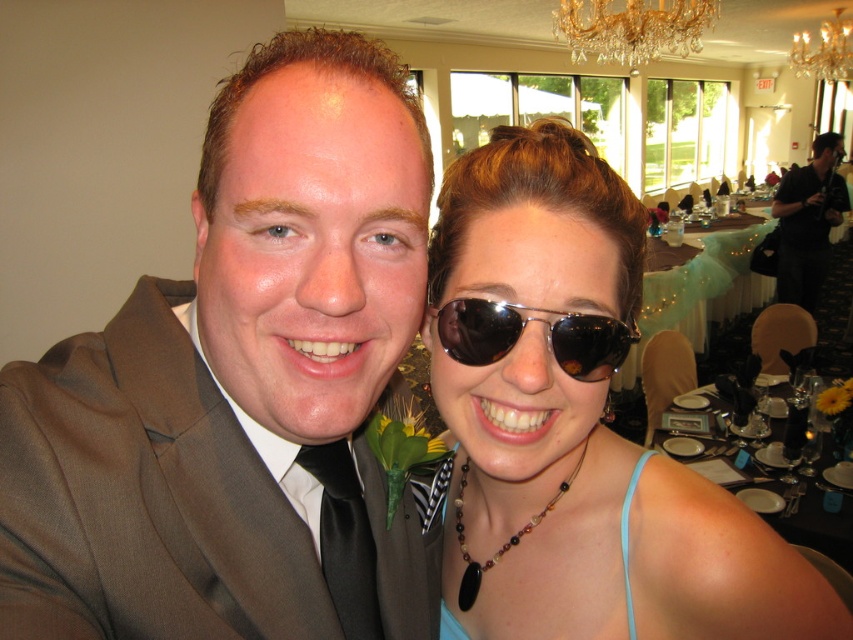
What is the coordinate of the black glassware at right?

The black glassware at right is located at coordinate point (790, 496).